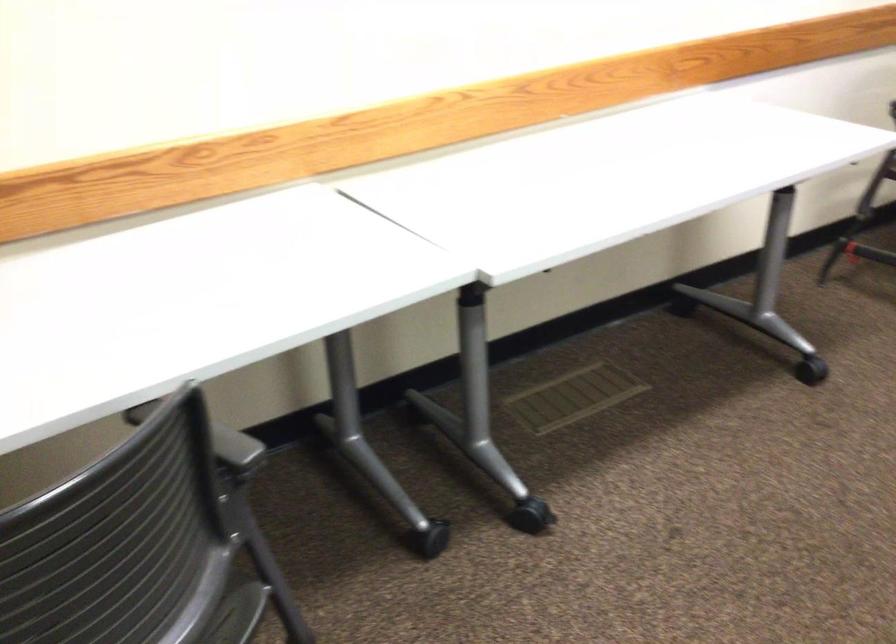
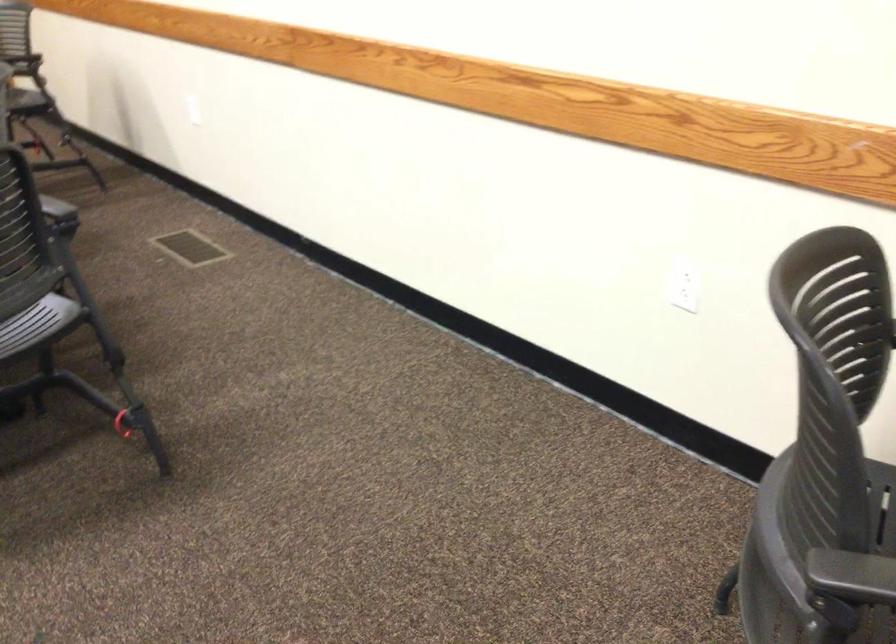
The point at [225,462] is marked in the first image. Where is the corresponding point in the second image?

(850, 573)